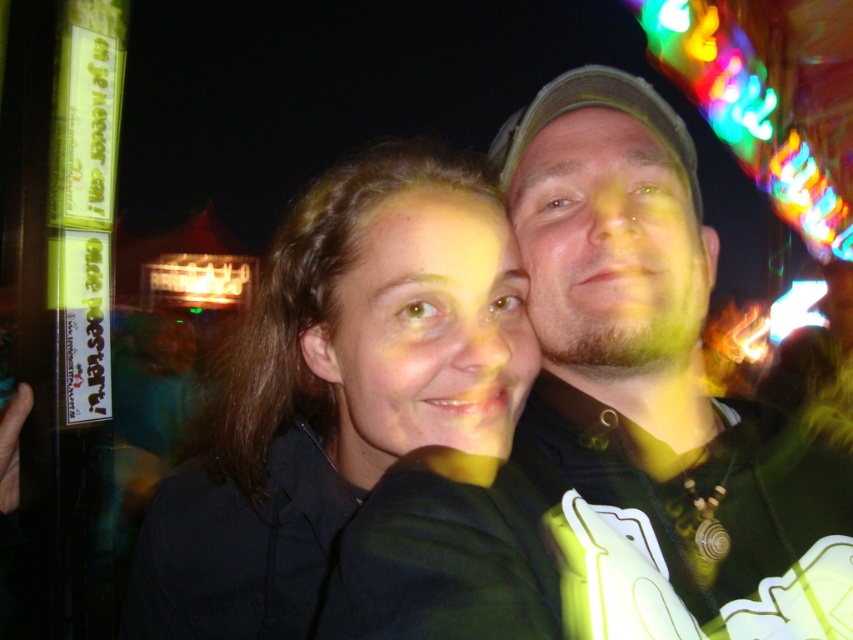
Question: Can you confirm if matte black hoodie at center is wider than dark brown hair at center?

Choices:
 (A) yes
 (B) no

Answer: (B)

Question: Is matte black hoodie at center wider than dark brown hair at center?

Choices:
 (A) yes
 (B) no

Answer: (B)

Question: Can you confirm if matte black hoodie at center is wider than dark brown hair at center?

Choices:
 (A) yes
 (B) no

Answer: (B)

Question: Which point appears farthest from the camera in this image?

Choices:
 (A) (131, 572)
 (B) (682, 492)

Answer: (A)

Question: Among these objects, which one is farthest from the camera?

Choices:
 (A) dark brown hair at center
 (B) matte black hoodie at center

Answer: (A)